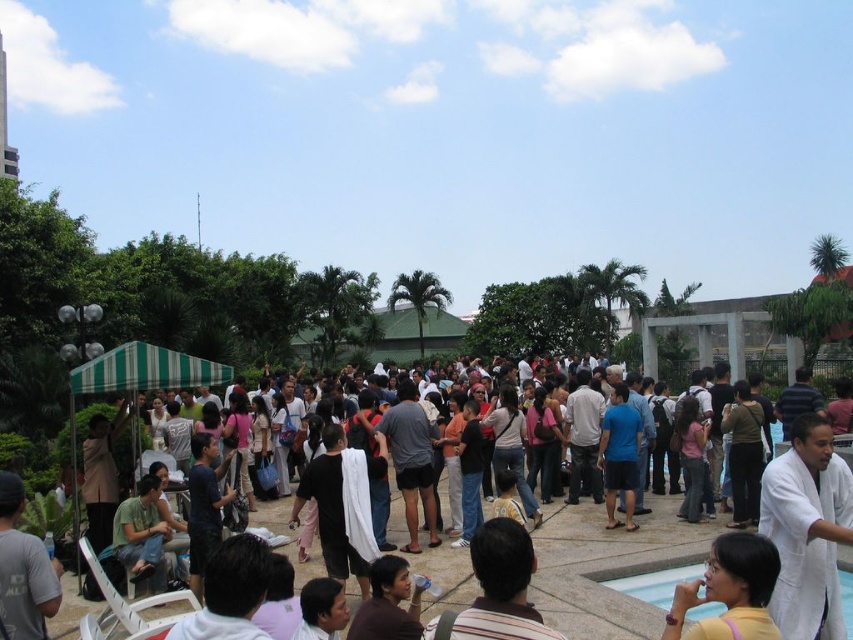
You are at an outdoor event and see a white cloth at center and a matte yellow shirt at lower right. Which item is positioned lower in the scene?

The white cloth at center is positioned lower than the matte yellow shirt at lower right.

You are a guest at this event and want to place a 10 feet long table between the white cloth at center and the white stone pool at lower right. Can you fit the table there without moving either object?

The distance between the white cloth at center and the white stone pool at lower right is 18.32 feet, which is greater than the table length of 10 feet. Therefore, the table can be placed between them without moving either object.